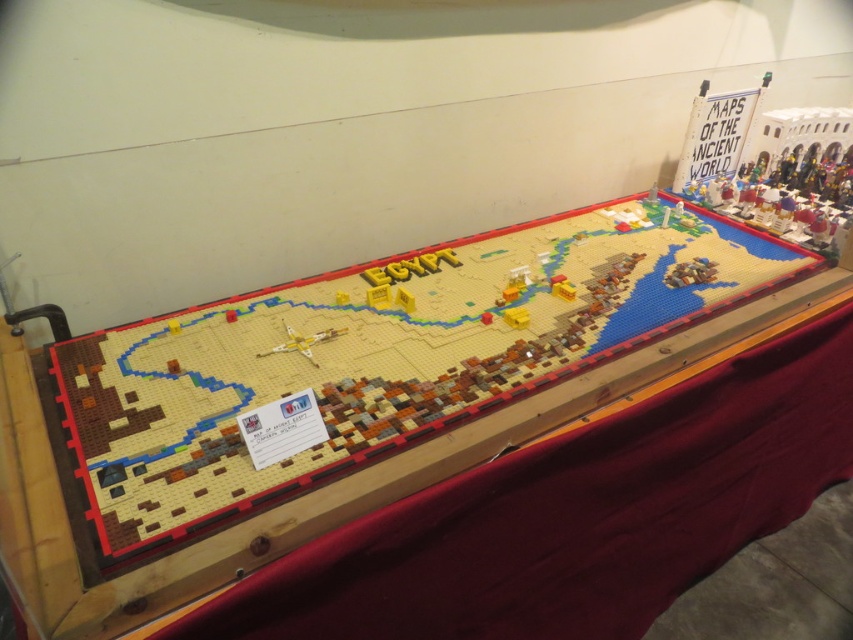
Question: Observing the image, what is the correct spatial positioning of wooden table at center in reference to translucent yellow airplane at center?

Choices:
 (A) below
 (B) above

Answer: (B)

Question: Does wooden table at center appear over translucent yellow airplane at center?

Choices:
 (A) no
 (B) yes

Answer: (B)

Question: Observing the image, what is the correct spatial positioning of wooden table at center in reference to translucent yellow airplane at center?

Choices:
 (A) right
 (B) left

Answer: (A)

Question: Among these points, which one is nearest to the camera?

Choices:
 (A) (294, 342)
 (B) (175, 392)

Answer: (B)

Question: Which point is farther to the camera?

Choices:
 (A) translucent yellow airplane at center
 (B) wooden table at center

Answer: (A)